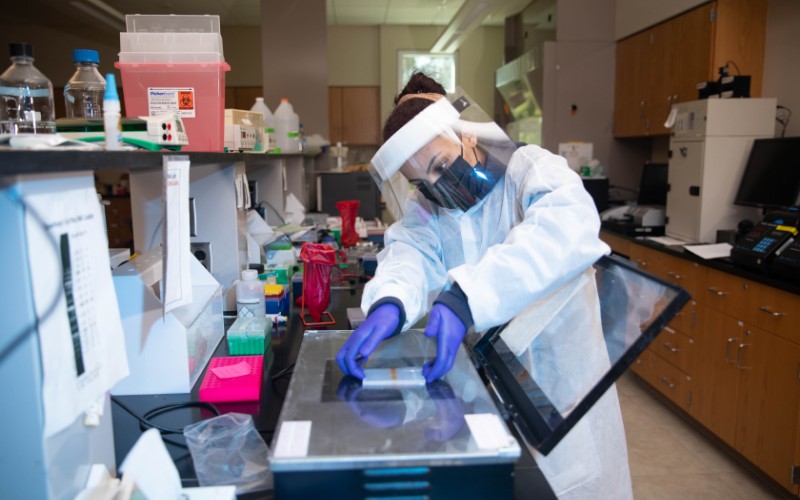
Find the location of a particular element. This screenshot has width=800, height=500. papers is located at coordinates (94, 313), (177, 227), (240, 190), (246, 194), (286, 179).